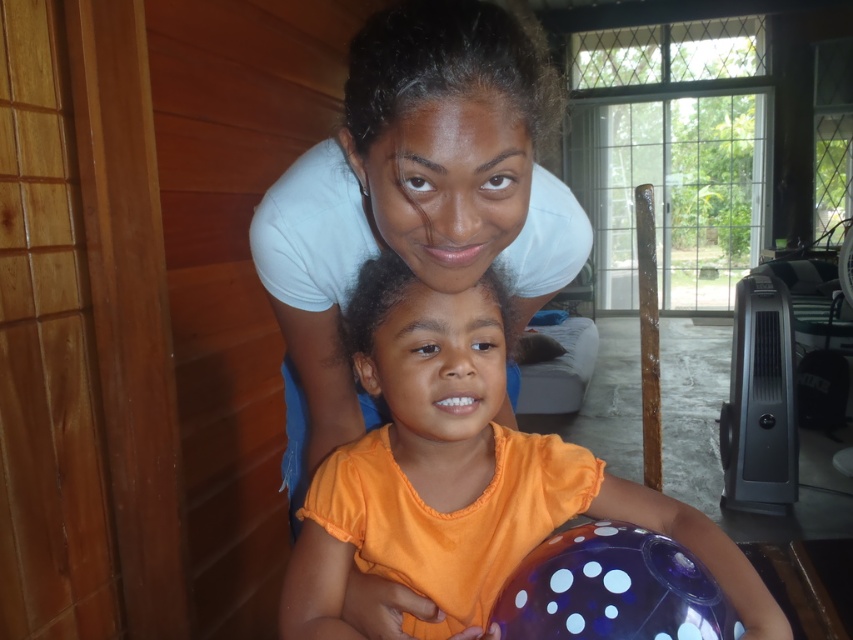
Question: Which point is farther to the camera?

Choices:
 (A) (489, 250)
 (B) (379, 458)

Answer: (B)

Question: Is orange matte shirt at center closer to the viewer compared to translucent purple beach ball at lower center?

Choices:
 (A) yes
 (B) no

Answer: (B)

Question: Among these objects, which one is farthest from the camera?

Choices:
 (A) white smooth t-shirt at upper center
 (B) orange matte shirt at center

Answer: (B)

Question: Where is white smooth t-shirt at upper center located in relation to translucent purple beach ball at lower center in the image?

Choices:
 (A) right
 (B) left

Answer: (B)

Question: Which is farther from the orange matte shirt at center?

Choices:
 (A) white smooth t-shirt at upper center
 (B) translucent purple beach ball at lower center

Answer: (A)

Question: Can you confirm if orange matte shirt at center is positioned to the left of translucent purple beach ball at lower center?

Choices:
 (A) no
 (B) yes

Answer: (B)